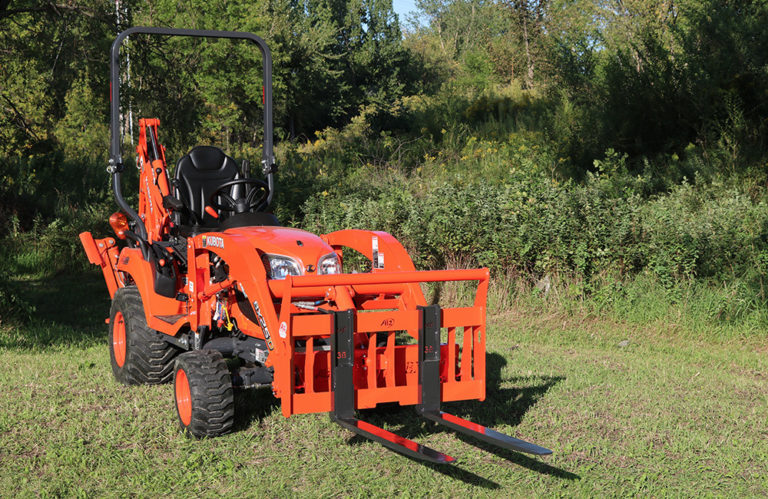
You are a GUI agent. You are given a task and a screenshot of the screen. Output one action in this format:
    pyautogui.click(x=<x>, y=<y>)
    Task: Click on the forks
    Image resolution: width=768 pixels, height=499 pixels.
    Given the screenshot: What is the action you would take?
    pyautogui.click(x=371, y=432), pyautogui.click(x=472, y=428)